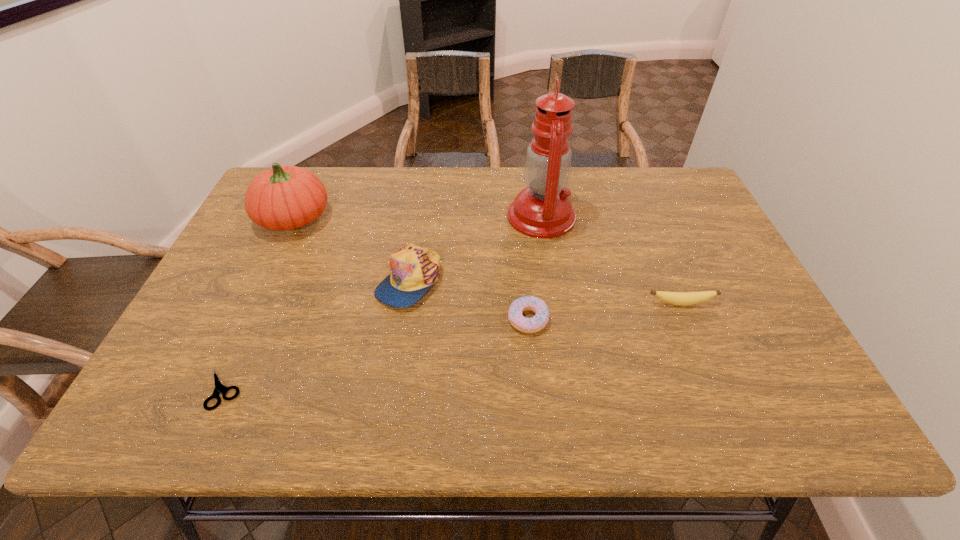
I want to click on vacant area situated on the bill of the fourth shortest object, so click(x=401, y=332).

The width and height of the screenshot is (960, 540). Find the location of `free region located on the left of the rightmost object`. free region located on the left of the rightmost object is located at coordinates (519, 303).

Locate an element on the screen. blank space located on the back of the doughnut is located at coordinates (519, 227).

What are the coordinates of `free space located on the right of the nearest object` in the screenshot? It's located at (296, 389).

Locate an element on the screen. oil lamp situated at the far edge is located at coordinates (543, 210).

The width and height of the screenshot is (960, 540). In order to click on pumpkin present at the far edge in this screenshot , I will do `click(284, 197)`.

Find the location of a particular element. This screenshot has width=960, height=540. object present at the near edge is located at coordinates (219, 388).

The width and height of the screenshot is (960, 540). I want to click on pumpkin at the left edge, so click(x=284, y=197).

The width and height of the screenshot is (960, 540). What are the coordinates of `shears that is at the left edge` in the screenshot? It's located at 219,388.

The image size is (960, 540). I want to click on object present at the right edge, so click(x=677, y=298).